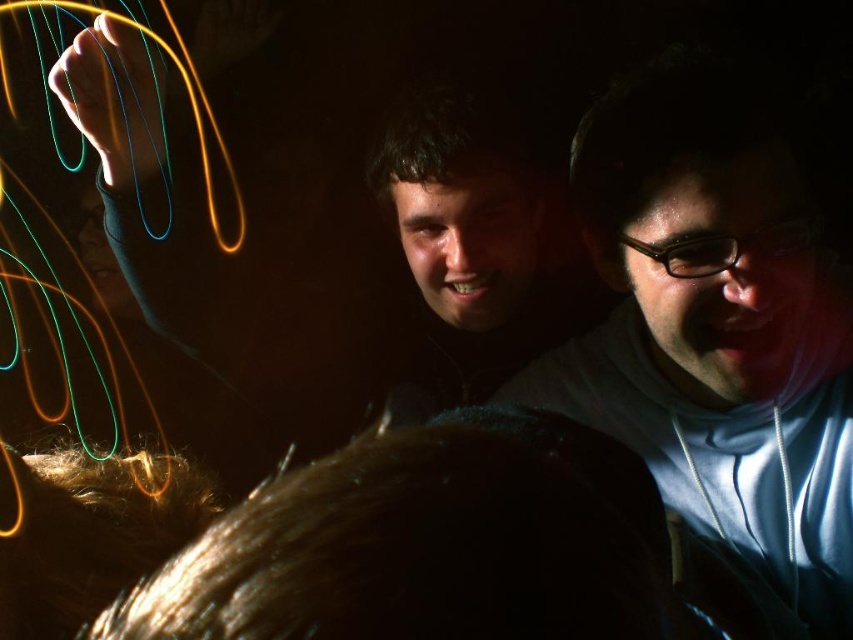
You are holding a camera and want to take a photo of the scene described. The camera has a focus range of up to 35 inches. Can you focus on the point at coordinates point (647, 305) without moving the camera?

The distance between point (647, 305) and the camera is 36.80 inches, which exceeds the camera focus range of 35 inches. Therefore, you cannot focus on the point at coordinates point (647, 305) without moving the camera.

You are at a party and want to take a photo of the matte white hoodie at center right and the matte black face at center. Which object should you focus on first if you want to capture both clearly in the same frame?

The matte white hoodie at center right is larger in size than the matte black face at center, so you should focus on the matte white hoodie at center right first to ensure both are in focus.

You are a photographer at the event and want to adjust your camera to focus on both the matte white hoodie at center right and the matte black face at center simultaneously. Can you do this without changing your camera settings?

The distance between the matte white hoodie at center right and the matte black face at center is 16.15 inches. Since this distance is relatively small, it is possible to adjust the camera settings to have both objects in focus by using a smaller aperture for a greater depth of field, allowing both subjects to be sharp in the photo.